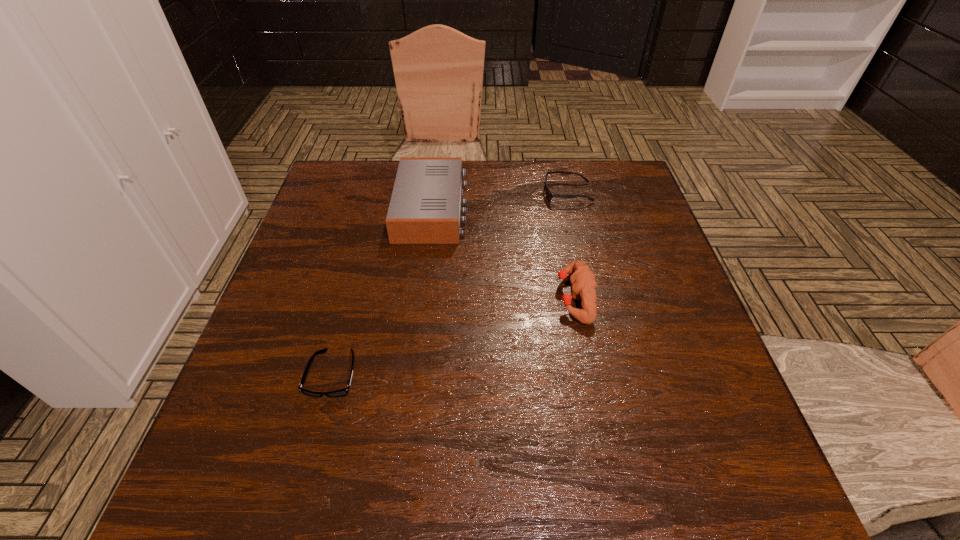
The height and width of the screenshot is (540, 960). In order to click on free spot between the second shortest object and the second object from left to right in this screenshot , I will do `click(500, 200)`.

Find the location of a particular element. free area in between the shortest object and the second nearest object is located at coordinates (454, 335).

Image resolution: width=960 pixels, height=540 pixels. In order to click on free space between the third object from right to left and the farther sunglasses in this screenshot , I will do `click(500, 200)`.

At what (x,y) coordinates should I click in order to perform the action: click on vacant space in between the third farthest object and the third object from right to left. Please return your answer as a coordinate pair (x, y). The width and height of the screenshot is (960, 540). Looking at the image, I should click on (503, 253).

The width and height of the screenshot is (960, 540). In order to click on empty location between the left sunglasses and the second nearest object in this screenshot , I will do `click(454, 335)`.

Image resolution: width=960 pixels, height=540 pixels. I want to click on unoccupied area between the shorter sunglasses and the second object from left to right, so click(x=382, y=291).

Locate an element on the screen. object that is the second closest to the radio receiver is located at coordinates (583, 282).

Where is `object identified as the closest to the leftmost object`? Image resolution: width=960 pixels, height=540 pixels. object identified as the closest to the leftmost object is located at coordinates (425, 208).

Image resolution: width=960 pixels, height=540 pixels. Find the location of `free region that satisfies the following two spatial constraints: 1. on the front panel of the radio receiver; 2. on the front-facing side of the shortest object`. free region that satisfies the following two spatial constraints: 1. on the front panel of the radio receiver; 2. on the front-facing side of the shortest object is located at coordinates (411, 374).

Identify the location of free spot that satisfies the following two spatial constraints: 1. on the front-facing side of the taller sunglasses; 2. on the front-facing side of the nearest object. This screenshot has width=960, height=540. (611, 374).